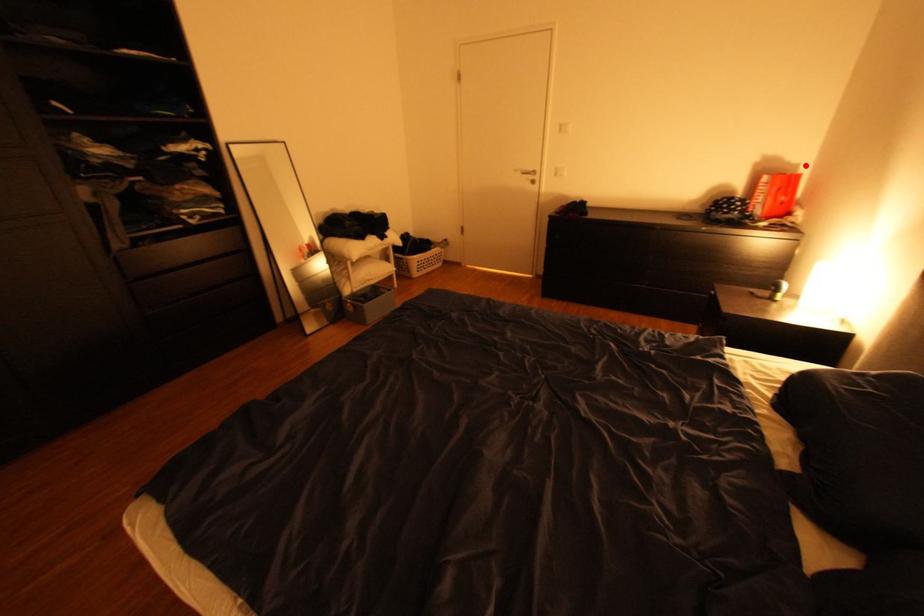
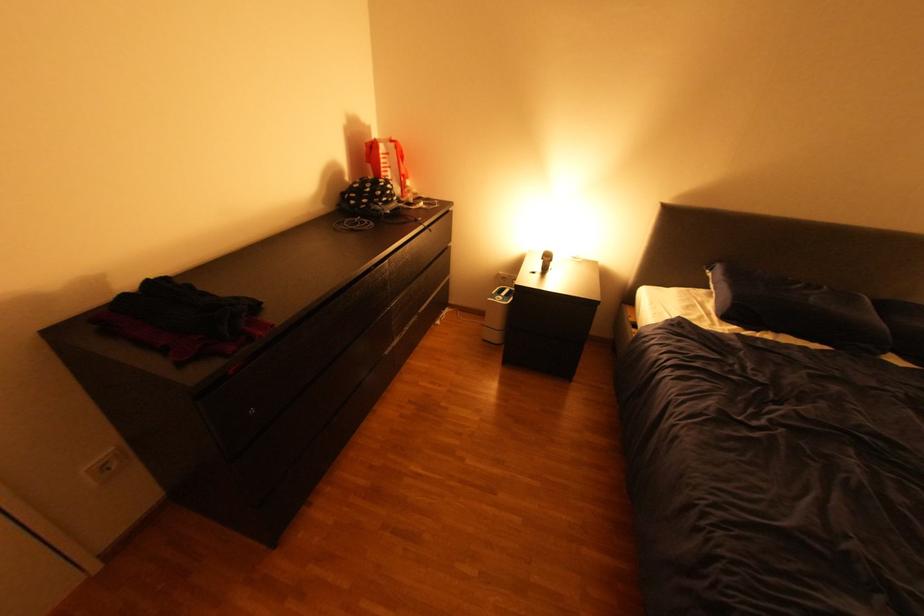
In the second image, find the point that corresponds to the highlighted location in the first image.

(379, 129)